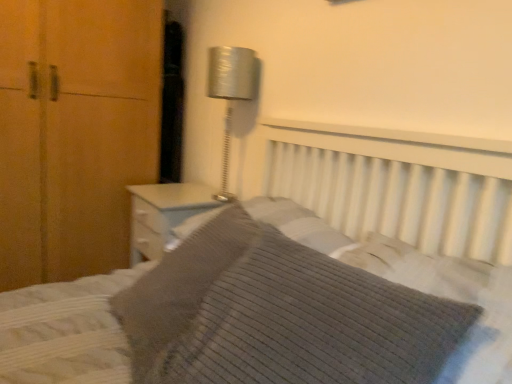
Question: In terms of height, does ribbed gray pillow at center, acting as the 1th pillow starting from the front, look taller or shorter compared to knitted fabric bed at center?

Choices:
 (A) tall
 (B) short

Answer: (B)

Question: Is ribbed gray pillow at center, acting as the 1th pillow starting from the front, situated inside knitted fabric bed at center or outside?

Choices:
 (A) inside
 (B) outside

Answer: (A)

Question: Which object is the farthest from the ribbed gray pillow at center, placed as the 2th pillow when sorted from back to front?

Choices:
 (A) knitted fabric bed at center
 (B) metallic silver lamp at upper center
 (C) knitted gray pillow at center, marked as the 1th pillow in a back-to-front arrangement

Answer: (B)

Question: Which is nearer to the ribbed gray pillow at center, placed as the 2th pillow when sorted from back to front?

Choices:
 (A) knitted gray pillow at center, marked as the 1th pillow in a back-to-front arrangement
 (B) metallic silver lamp at upper center
 (C) knitted fabric bed at center

Answer: (C)